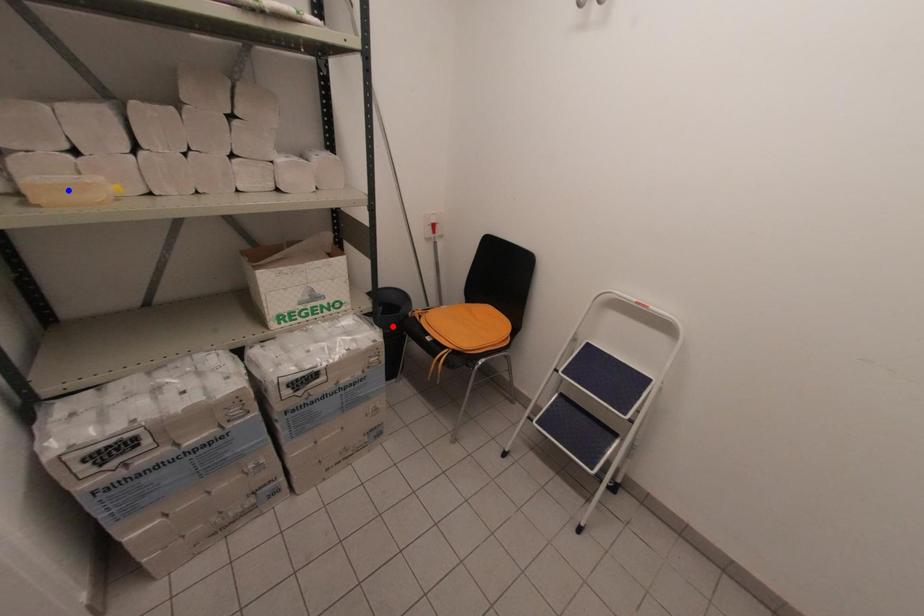
Question: Two points are marked on the image. Which point is closer to the camera?

Choices:
 (A) Blue point is closer.
 (B) Red point is closer.

Answer: (A)